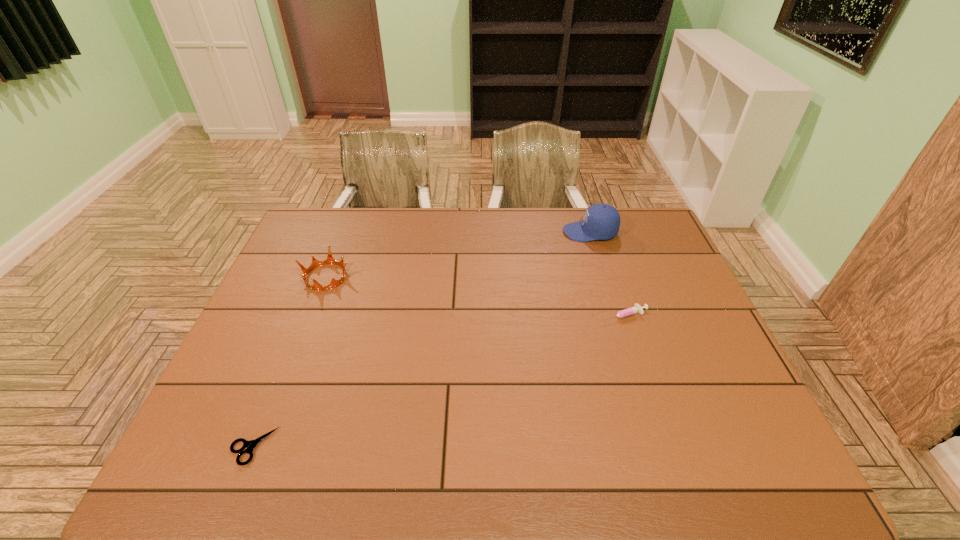
Identify the location of vacant area that lies between the syringe and the farthest object. (607, 274).

You are a GUI agent. You are given a task and a screenshot of the screen. Output one action in this format:
    pyautogui.click(x=<x>, y=<y>)
    Task: Click on the empty space that is in between the tallest object and the third nearest object
    This screenshot has height=540, width=960.
    Given the screenshot: What is the action you would take?
    pyautogui.click(x=458, y=254)

I want to click on vacant space in between the tallest object and the shears, so click(x=421, y=339).

The height and width of the screenshot is (540, 960). What are the coordinates of `unoccupied position between the second tallest object and the shears` in the screenshot? It's located at (289, 362).

Identify the location of empty space between the syringe and the crown. (474, 296).

The image size is (960, 540). Find the location of `free point between the syringe and the shears`. free point between the syringe and the shears is located at coordinates (438, 381).

Identify which object is the nearest to the crown. Please provide its 2D coordinates. Your answer should be formatted as a tuple, i.e. [(x, y)], where the tuple contains the x and y coordinates of a point satisfying the conditions above.

[(250, 445)]

Where is `object that is the third closest to the nearest object`? object that is the third closest to the nearest object is located at coordinates (601, 221).

Locate an element on the screen. This screenshot has height=540, width=960. vacant area in the image that satisfies the following two spatial constraints: 1. on the front-facing side of the farthest object; 2. on the front side of the shortest object is located at coordinates (657, 447).

At what (x,y) coordinates should I click in order to perform the action: click on free location that satisfies the following two spatial constraints: 1. on the front-facing side of the farthest object; 2. on the left side of the third tallest object. Please return your answer as a coordinate pair (x, y). This screenshot has width=960, height=540. Looking at the image, I should click on (615, 315).